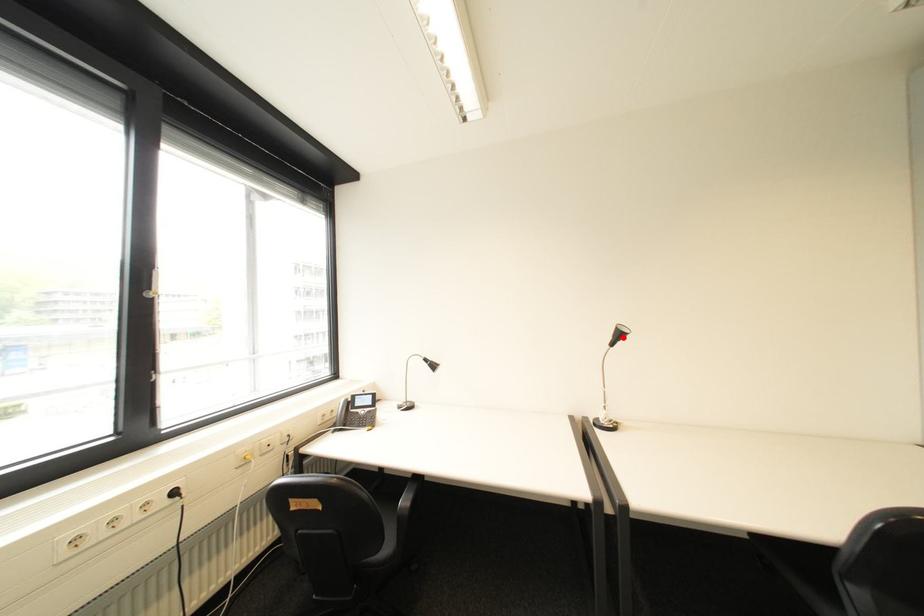
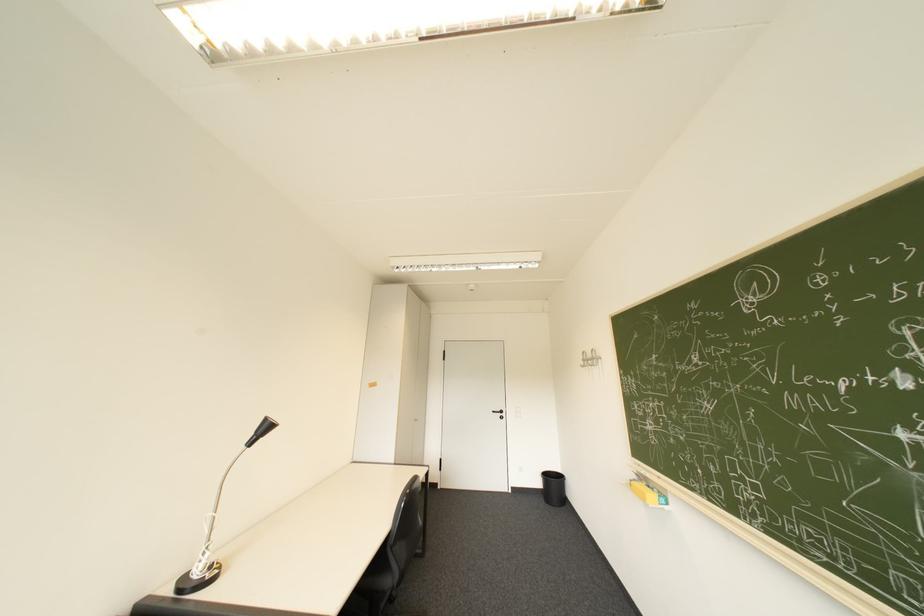
The point at the highlighted location is marked in the first image. Where is the corresponding point in the second image?

(266, 434)